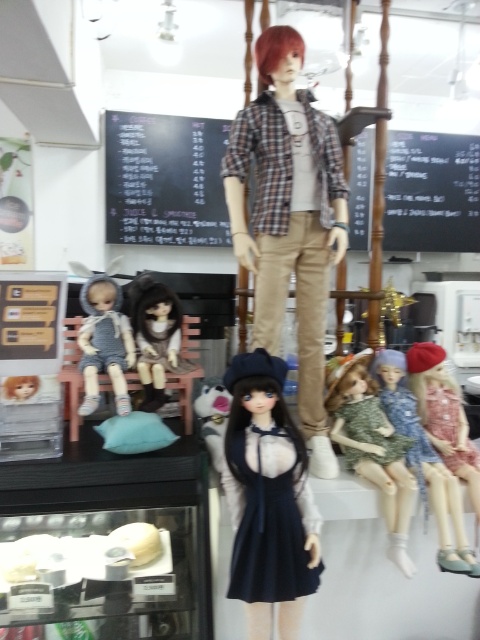
Question: Which point is closer to the camera?

Choices:
 (A) black chalkboard at upper center
 (B) matte gray fabric doll at lower left
 (C) shiny brown hair at center

Answer: (B)

Question: Which object appears closest to the camera in this image?

Choices:
 (A) blackboard at upper center
 (B) matte gray fabric doll at lower left
 (C) shiny brown hair at center
 (D) blackboard at center

Answer: (B)

Question: Which point is farther from the camera taking this photo?

Choices:
 (A) (139, 204)
 (B) (264, 557)
 (C) (141, 296)
 (D) (152, 211)

Answer: (D)

Question: Is blackboard at upper center below matte green dress at center?

Choices:
 (A) yes
 (B) no

Answer: (B)

Question: Can you confirm if plaid fabric doll at center is bigger than satin black dress at center?

Choices:
 (A) no
 (B) yes

Answer: (B)

Question: Is blackboard at upper center smaller than matte green dress at center?

Choices:
 (A) no
 (B) yes

Answer: (A)